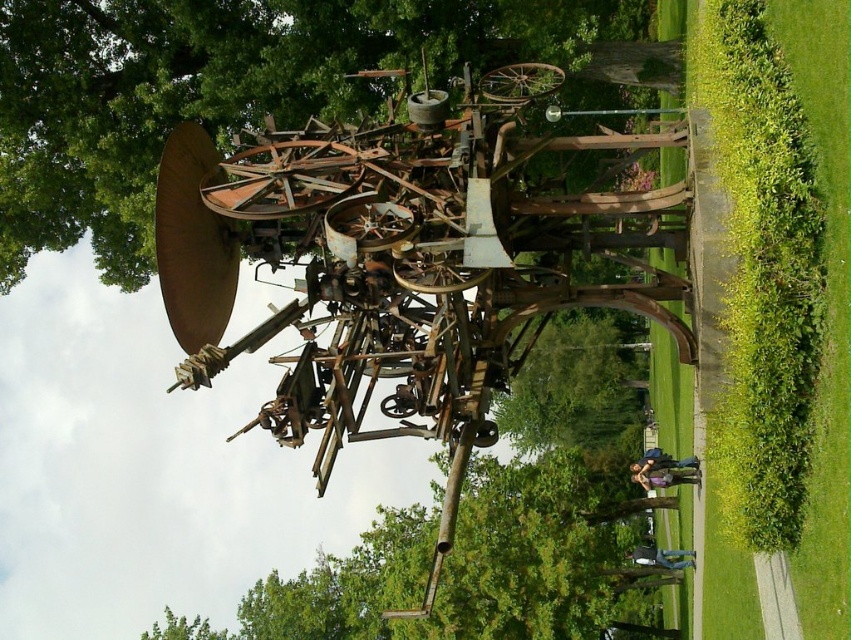
You are a park maintenance worker who needs to water the green leafy tree at center. You have a hose that can reach 10 meters. The rusty metal sculpture at center is in the way. Can you water the tree without moving the sculpture?

The rusty metal sculpture at center and green leafy tree at center are 13.02 meters apart from each other. Since the hose can only reach 10 meters, you cannot water the tree without moving the sculpture.

You are a landscape architect planning to place a new bench in the park. You want to ensure there is enough space between the rusty metal sculpture at center and the green leafy tree at center. Based on their widths, which object requires more horizontal space to accommodate its width?

The green leafy tree at center requires more horizontal space because its width is greater than the rusty metal sculpture at center.

You are standing in the park and want to take a photo of the rusty metal sculpture at center. If your camera has a maximum zoom range of 20 meters, can you capture the entire sculpture without moving closer?

The rusty metal sculpture at center is 26.76 meters away from the camera, which exceeds the camera maximum zoom range of 20 meters. Therefore, you cannot capture the entire sculpture without moving closer.